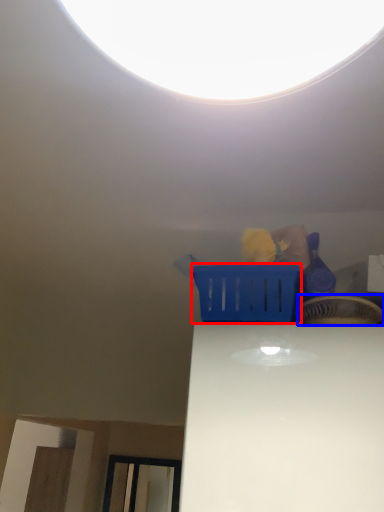
Question: Among these objects, which one is farthest to the camera, basket (highlighted by a red box) or basket (highlighted by a blue box)?

Choices:
 (A) basket
 (B) basket

Answer: (A)